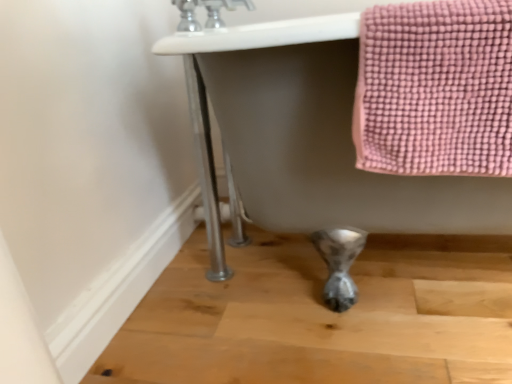
Describe the element at coordinates (207, 12) in the screenshot. I see `silver metallic faucet at upper center` at that location.

What is the approximate height of silver metallic faucet at upper center?

6.12 inches.

Where is `silver metallic faucet at upper center`? silver metallic faucet at upper center is located at coordinates (207, 12).

Where is `white glossy bathtub at center`? Image resolution: width=512 pixels, height=384 pixels. white glossy bathtub at center is located at coordinates click(359, 125).

What do you see at coordinates (359, 125) in the screenshot?
I see `white glossy bathtub at center` at bounding box center [359, 125].

The width and height of the screenshot is (512, 384). Find the location of `silver metallic faucet at upper center`. silver metallic faucet at upper center is located at coordinates (207, 12).

From the picture: Which object is positioned more to the right, silver metallic faucet at upper center or white glossy bathtub at center?

white glossy bathtub at center is more to the right.

Between silver metallic faucet at upper center and white glossy bathtub at center, which one is positioned in front?

white glossy bathtub at center is closer to the camera.

In the scene shown: Which is closer, (183, 6) or (302, 218)?

The point (302, 218) is closer.

From the image's perspective, would you say silver metallic faucet at upper center is positioned over white glossy bathtub at center?

Indeed, from the image's perspective, silver metallic faucet at upper center is shown above white glossy bathtub at center.

From a real-world perspective, which is physically above, silver metallic faucet at upper center or white glossy bathtub at center?

silver metallic faucet at upper center is physically above.

Which object is wider, silver metallic faucet at upper center or white glossy bathtub at center?

With larger width is white glossy bathtub at center.

Can you confirm if silver metallic faucet at upper center is shorter than white glossy bathtub at center?

Indeed, silver metallic faucet at upper center has a lesser height compared to white glossy bathtub at center.

Between silver metallic faucet at upper center and white glossy bathtub at center, which one has smaller size?

Smaller between the two is silver metallic faucet at upper center.

Would you say silver metallic faucet at upper center is inside or outside white glossy bathtub at center?

silver metallic faucet at upper center cannot be found inside white glossy bathtub at center.

Are silver metallic faucet at upper center and white glossy bathtub at center far apart?

No, silver metallic faucet at upper center is not far from white glossy bathtub at center.

Could you tell me if silver metallic faucet at upper center is turned towards white glossy bathtub at center?

No, silver metallic faucet at upper center is not turned towards white glossy bathtub at center.

Can you tell me how much silver metallic faucet at upper center and white glossy bathtub at center differ in facing direction?

87.8 degrees separate the facing orientations of silver metallic faucet at upper center and white glossy bathtub at center.

You are a GUI agent. You are given a task and a screenshot of the screen. Output one action in this format:
    pyautogui.click(x=<x>, y=<y>)
    Task: Click on the faucet on the left of white glossy bathtub at center
    This screenshot has width=512, height=384.
    Given the screenshot: What is the action you would take?
    pyautogui.click(x=207, y=12)

In the image, is white glossy bathtub at center on the left side or the right side of silver metallic faucet at upper center?

Based on their positions, white glossy bathtub at center is located to the right of silver metallic faucet at upper center.

Is the depth of white glossy bathtub at center greater than that of silver metallic faucet at upper center?

No, the depth of white glossy bathtub at center is less than that of silver metallic faucet at upper center.

Which point is more distant from viewer, [370,45] or [220,26]?

The point [220,26] is farther.

In the scene shown: From the image's perspective, does white glossy bathtub at center appear lower than silver metallic faucet at upper center?

Yes, from the image's perspective, white glossy bathtub at center is beneath silver metallic faucet at upper center.

From a real-world perspective, is white glossy bathtub at center located beneath silver metallic faucet at upper center?

Yes, from a real-world perspective, white glossy bathtub at center is below silver metallic faucet at upper center.

Based on the photo, looking at their sizes, would you say white glossy bathtub at center is wider or thinner than silver metallic faucet at upper center?

Considering their sizes, white glossy bathtub at center looks broader than silver metallic faucet at upper center.

Does white glossy bathtub at center have a lesser height compared to silver metallic faucet at upper center?

No.

Considering the sizes of objects white glossy bathtub at center and silver metallic faucet at upper center in the image provided, who is bigger, white glossy bathtub at center or silver metallic faucet at upper center?

white glossy bathtub at center.

Is white glossy bathtub at center outside of silver metallic faucet at upper center?

white glossy bathtub at center lies outside silver metallic faucet at upper center's area.

Are white glossy bathtub at center and silver metallic faucet at upper center located far from each other?

white glossy bathtub at center is near silver metallic faucet at upper center, not far away.

Could you tell me if white glossy bathtub at center is facing silver metallic faucet at upper center?

No, white glossy bathtub at center is not oriented towards silver metallic faucet at upper center.

How many degrees apart are the facing directions of white glossy bathtub at center and silver metallic faucet at upper center?

They differ by 87.8 degrees in their facing directions.

Find the location of `faucet behind the white glossy bathtub at center`. faucet behind the white glossy bathtub at center is located at coordinates (207, 12).

At what (x,y) coordinates should I click in order to perform the action: click on faucet located above the white glossy bathtub at center (from the image's perspective). Please return your answer as a coordinate pair (x, y). Looking at the image, I should click on (207, 12).

Locate an element on the screen. The width and height of the screenshot is (512, 384). bath in front of the silver metallic faucet at upper center is located at coordinates (359, 125).